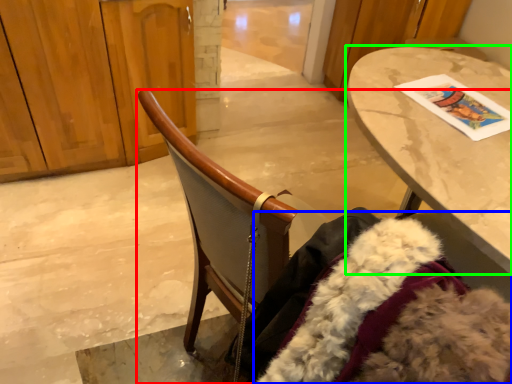
Question: Based on their relative distances, which object is farther from chair (highlighted by a red box)? Choose from fur coat (highlighted by a blue box) and table (highlighted by a green box).

Choices:
 (A) fur coat
 (B) table

Answer: (B)